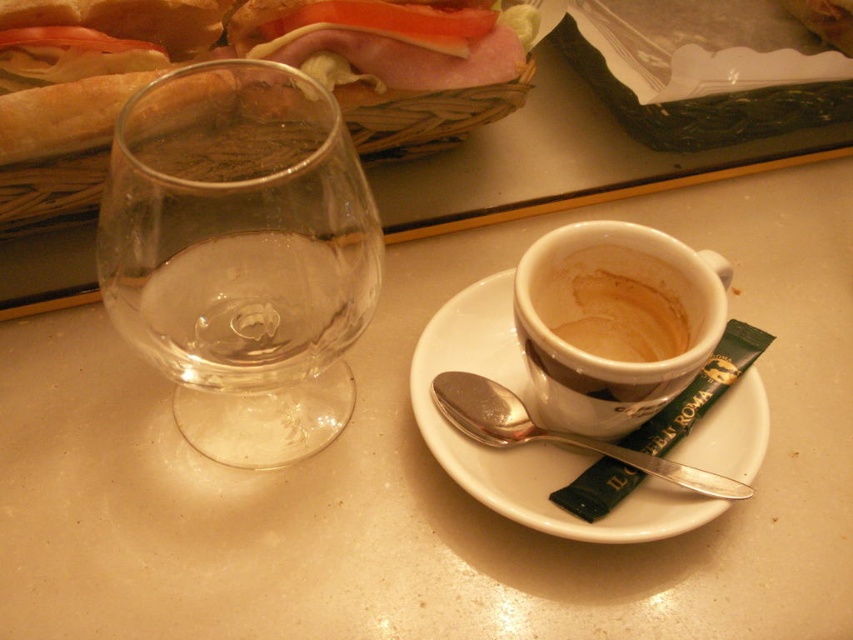
Question: Which point appears closest to the camera in this image?

Choices:
 (A) (750, 435)
 (B) (575, 307)
 (C) (492, 387)
 (D) (216, 336)

Answer: (D)

Question: Can you confirm if white ceramic saucer at center is positioned to the left of brown matte cup at center right?

Choices:
 (A) yes
 (B) no

Answer: (A)

Question: Which is farther from the white ceramic saucer at center?

Choices:
 (A) brown matte cup at center right
 (B) silver metallic spoon at upper center
 (C) translucent glass sandwich at upper left
 (D) transparent glass wine glass at left

Answer: (C)

Question: Does transparent glass wine glass at left appear on the left side of white ceramic saucer at center?

Choices:
 (A) yes
 (B) no

Answer: (A)

Question: Is brown matte cup at center right wider than silver metallic spoon at upper center?

Choices:
 (A) no
 (B) yes

Answer: (A)

Question: Considering the real-world distances, which object is closest to the brown matte cup at center right?

Choices:
 (A) white ceramic saucer at center
 (B) transparent glass wine glass at left
 (C) translucent glass sandwich at upper left
 (D) hammy bread at upper left

Answer: (A)